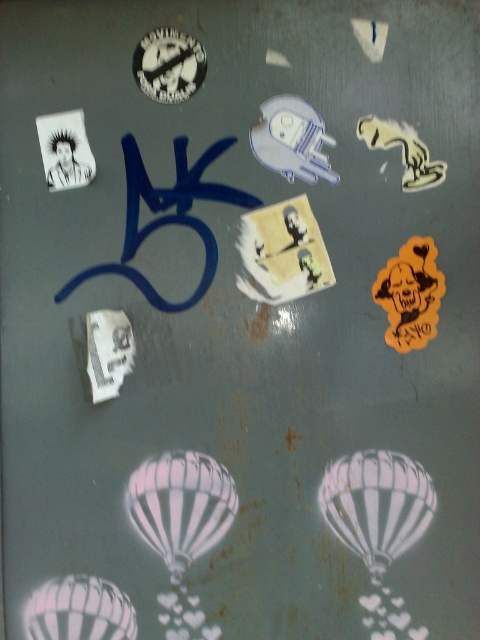
Question: Which point is closer to the camera taking this photo?

Choices:
 (A) (56, 602)
 (B) (180, 548)

Answer: (A)

Question: Which point is farther to the camera?

Choices:
 (A) (140, 484)
 (B) (375, 518)

Answer: (A)

Question: Is white striped balloon at lower center further to the viewer compared to white striped balloon at lower left?

Choices:
 (A) no
 (B) yes

Answer: (B)

Question: Is white striped balloon at lower center above white striped balloon at center?

Choices:
 (A) yes
 (B) no

Answer: (A)

Question: Among these points, which one is farthest from the camera?

Choices:
 (A) (52, 611)
 (B) (391, 500)
 (C) (180, 573)

Answer: (B)

Question: Is white striped balloon at lower center positioned behind white striped balloon at center?

Choices:
 (A) yes
 (B) no

Answer: (B)